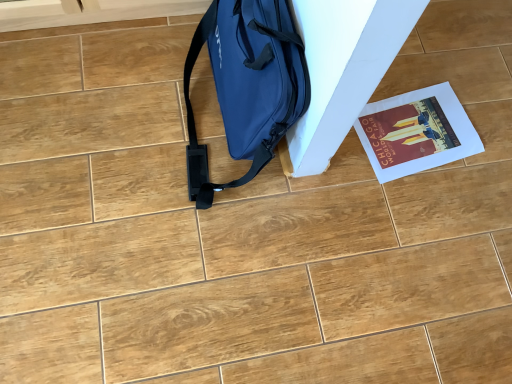
At what (x,y) coordinates should I click in order to perform the action: click on free location in front of matte paper poster at lower right. Please return your answer as a coordinate pair (x, y). The image size is (512, 384). Looking at the image, I should click on (413, 224).